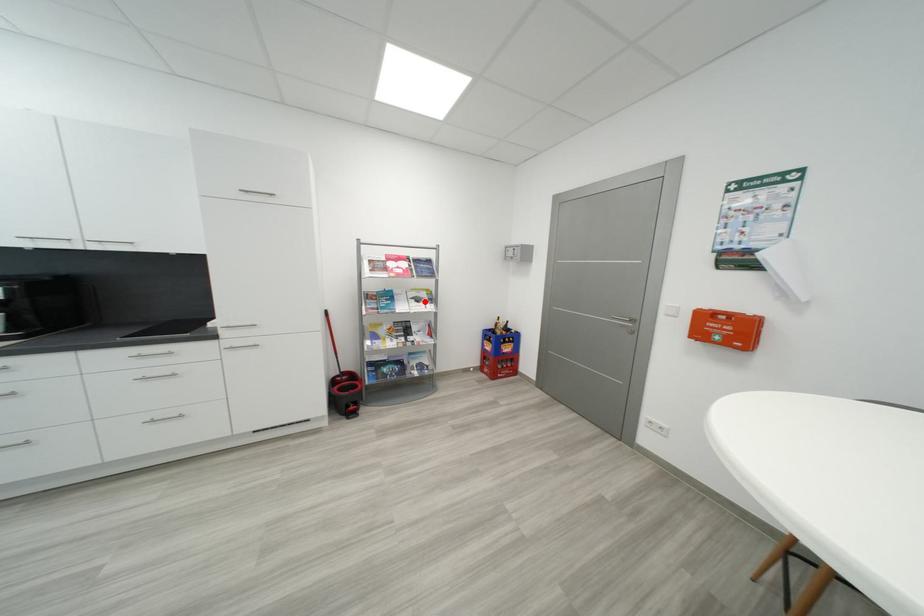
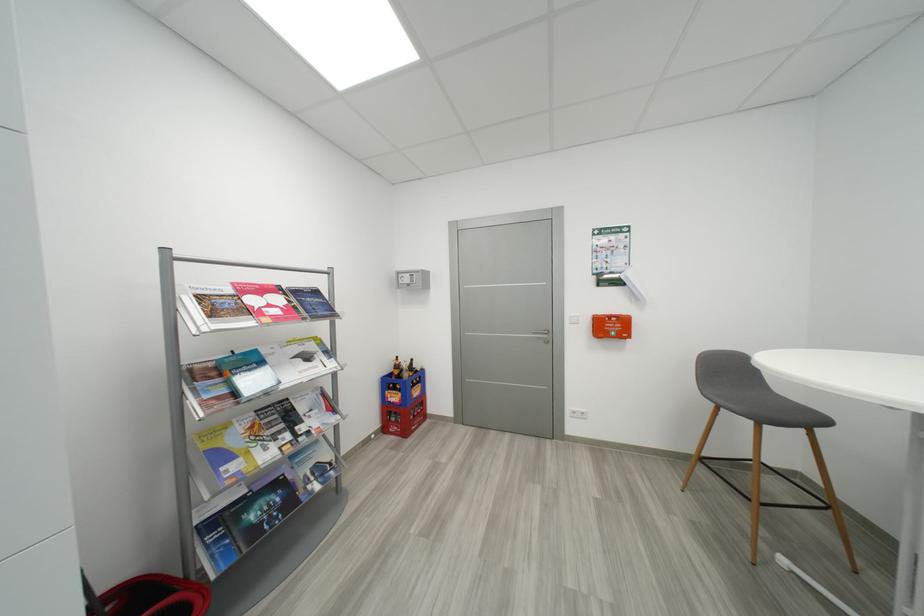
Where in the second image is the point corresponding to the highlighted location from the first image?

(314, 359)